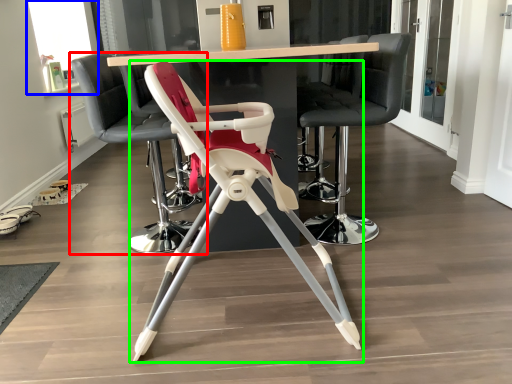
Question: Which object is positioned farthest from chair (highlighted by a red box)? Select from window screen (highlighted by a blue box) and chair (highlighted by a green box).

Choices:
 (A) window screen
 (B) chair

Answer: (A)